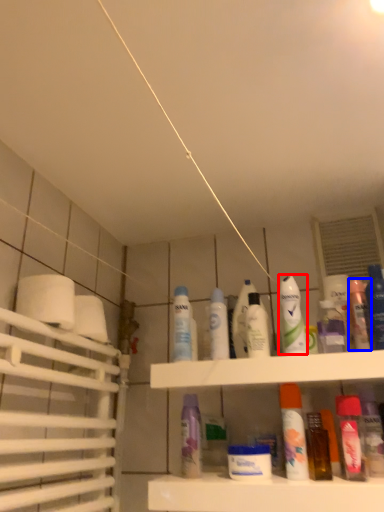
Question: Which object appears closest to the camera in this image, mouthwash (highlighted by a red box) or mouthwash (highlighted by a blue box)?

Choices:
 (A) mouthwash
 (B) mouthwash

Answer: (A)